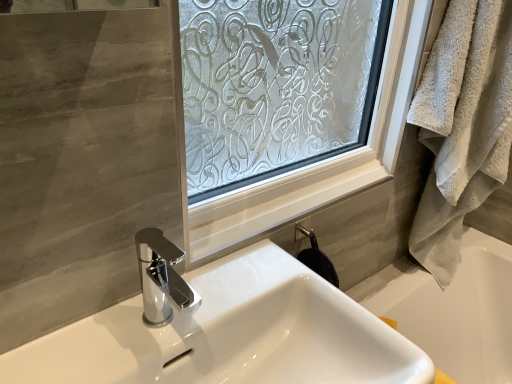
Question: From a real-world perspective, is white glossy bathtub at lower right positioned over beige fluffy towel at right based on gravity?

Choices:
 (A) no
 (B) yes

Answer: (A)

Question: From the image's perspective, is white glossy bathtub at lower right on beige fluffy towel at right?

Choices:
 (A) yes
 (B) no

Answer: (B)

Question: From a real-world perspective, does white glossy bathtub at lower right sit lower than beige fluffy towel at right?

Choices:
 (A) no
 (B) yes

Answer: (B)

Question: Can you confirm if white glossy bathtub at lower right is positioned to the right of beige fluffy towel at right?

Choices:
 (A) yes
 (B) no

Answer: (B)

Question: Is white glossy bathtub at lower right to the left of beige fluffy towel at right from the viewer's perspective?

Choices:
 (A) yes
 (B) no

Answer: (A)

Question: Based on their sizes in the image, would you say beige fluffy towel at right is bigger or smaller than white glossy sink at center?

Choices:
 (A) big
 (B) small

Answer: (B)

Question: Would you say beige fluffy towel at right is inside or outside white glossy sink at center?

Choices:
 (A) outside
 (B) inside

Answer: (A)

Question: From a real-world perspective, is beige fluffy towel at right physically located above or below white glossy sink at center?

Choices:
 (A) above
 (B) below

Answer: (A)

Question: From their relative heights in the image, would you say beige fluffy towel at right is taller or shorter than white glossy sink at center?

Choices:
 (A) short
 (B) tall

Answer: (B)

Question: Looking at their shapes, would you say white glossy bathtub at lower right is wider or thinner than beige fluffy towel at right?

Choices:
 (A) thin
 (B) wide

Answer: (A)

Question: From the image's perspective, is white glossy bathtub at lower right located above or below beige fluffy towel at right?

Choices:
 (A) below
 (B) above

Answer: (A)

Question: Which is correct: white glossy bathtub at lower right is inside beige fluffy towel at right, or outside of it?

Choices:
 (A) outside
 (B) inside

Answer: (A)

Question: From a real-world perspective, is white glossy bathtub at lower right above or below beige fluffy towel at right?

Choices:
 (A) above
 (B) below

Answer: (B)

Question: From the image's perspective, is white glossy bathtub at lower right located above or below white glossy sink at center?

Choices:
 (A) below
 (B) above

Answer: (A)

Question: Considering the positions of white glossy bathtub at lower right and white glossy sink at center in the image, is white glossy bathtub at lower right taller or shorter than white glossy sink at center?

Choices:
 (A) short
 (B) tall

Answer: (A)